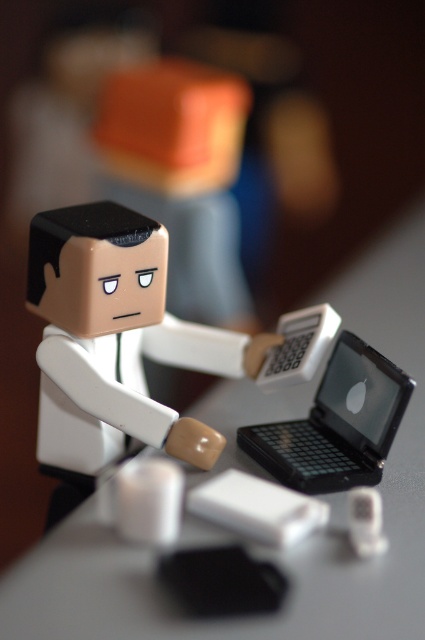
Between point (144, 424) and point (380, 435), which one is positioned in front?

Point (144, 424) is more forward.

Between white matte figure at center and black plastic laptop at center, which one appears on the right side from the viewer's perspective?

black plastic laptop at center

What are the coordinates of `white matte figure at center` in the screenshot? It's located at (116, 340).

Locate an element on the screen. This screenshot has width=425, height=640. white matte figure at center is located at coordinates (116, 340).